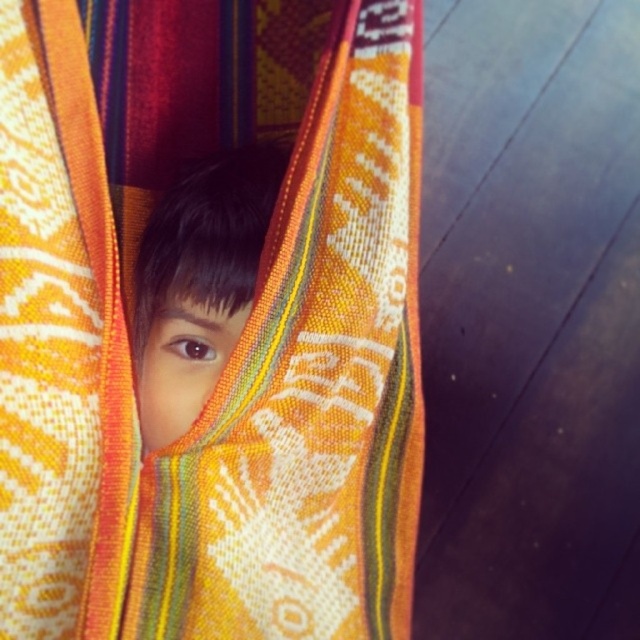
Which is above, textured woven fabric at center or smooth skin face at center?

smooth skin face at center is above.

Does textured woven fabric at center appear under smooth skin face at center?

Yes, textured woven fabric at center is below smooth skin face at center.

Measure the distance between textured woven fabric at center and camera.

textured woven fabric at center and camera are 65.35 centimeters apart from each other.

Where is `textured woven fabric at center`? The image size is (640, 640). textured woven fabric at center is located at coordinates (214, 304).